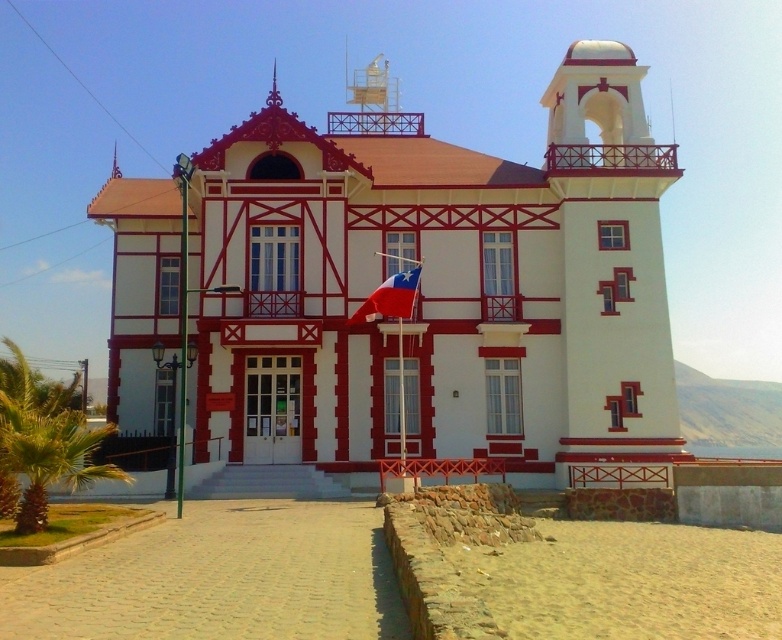
Question: Does green leafy palm tree at lower left have a smaller size compared to red fabric flag at center?

Choices:
 (A) no
 (B) yes

Answer: (A)

Question: Which point is closer to the camera?

Choices:
 (A) red fabric flag at center
 (B) green leafy palm tree at lower left
 (C) white painted wood tower at center

Answer: (B)

Question: Does white painted wood tower at center appear on the left side of red fabric flag at center?

Choices:
 (A) no
 (B) yes

Answer: (A)

Question: Is green leafy palm tree at lower left below red fabric flag at center?

Choices:
 (A) yes
 (B) no

Answer: (A)

Question: Which object appears closest to the camera in this image?

Choices:
 (A) white painted wood tower at center
 (B) red fabric flag at center

Answer: (A)

Question: Which point is closer to the camera taking this photo?

Choices:
 (A) (400, 272)
 (B) (511, 204)
 (C) (102, 432)

Answer: (C)